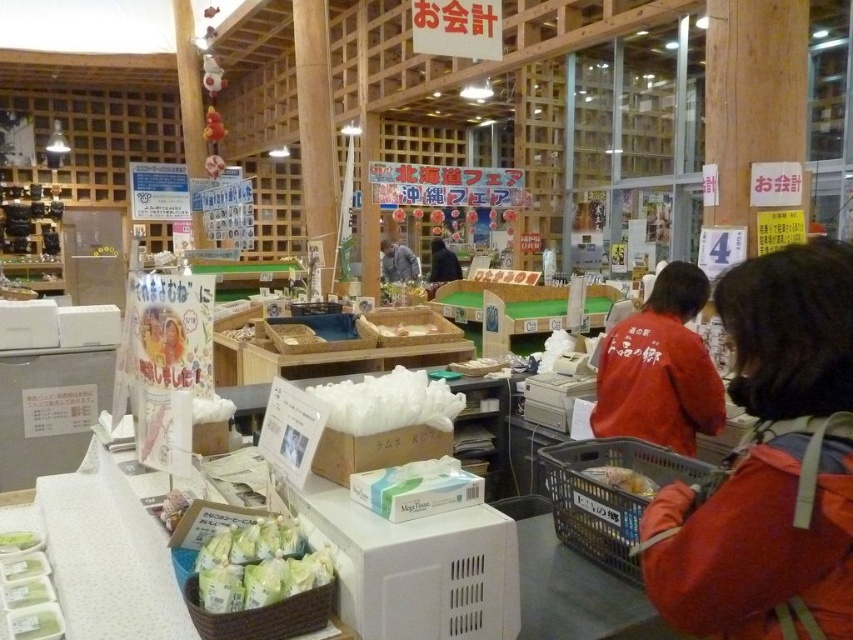
What do you see at coordinates (389, 403) in the screenshot?
I see `white styrofoam food at center` at bounding box center [389, 403].

Is white styrofoam food at center further to the viewer compared to green woven basket at lower center?

Yes, white styrofoam food at center is behind green woven basket at lower center.

Does point (418, 406) come closer to viewer compared to point (199, 609)?

No.

I want to click on white styrofoam food at center, so click(x=389, y=403).

Who is taller, red matte shirt at center or green woven basket at lower center?

red matte shirt at center is taller.

Can you confirm if red matte shirt at center is positioned to the right of green woven basket at lower center?

Yes, red matte shirt at center is to the right of green woven basket at lower center.

Is point (648, 358) positioned behind point (274, 620)?

That is True.

Find the location of a particular element. Image resolution: width=853 pixels, height=640 pixels. red matte shirt at center is located at coordinates tap(659, 369).

Is white styrofoam food at center above dark blue shirt at center?

Actually, white styrofoam food at center is below dark blue shirt at center.

Can you confirm if white styrofoam food at center is wider than dark blue shirt at center?

No, white styrofoam food at center is not wider than dark blue shirt at center.

Does point (418, 376) come farther from viewer compared to point (457, 275)?

No, it is not.

Where is `white styrofoam food at center`? The width and height of the screenshot is (853, 640). white styrofoam food at center is located at coordinates (389, 403).